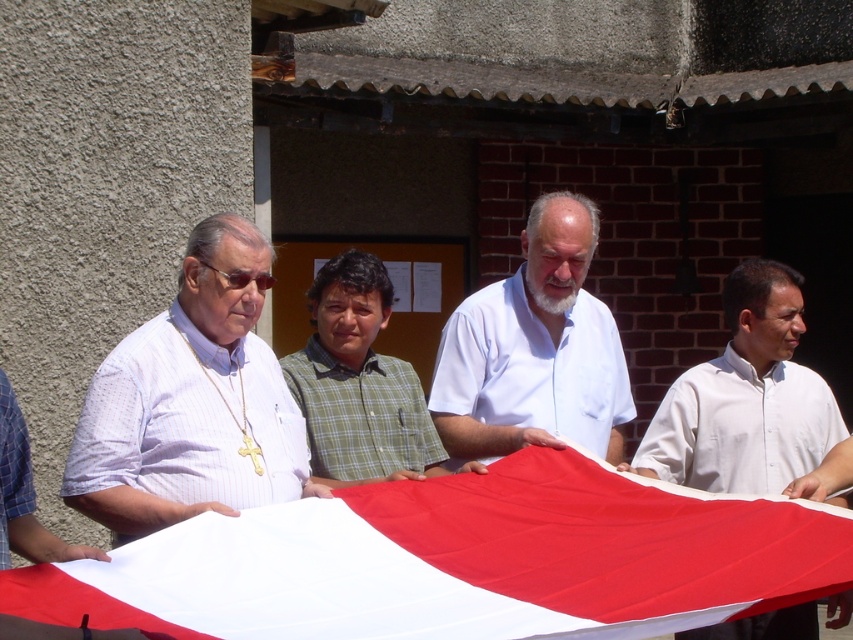
Question: Which object is closer to the camera taking this photo?

Choices:
 (A) white matte shirt at center
 (B) green checkered shirt at center
 (C) white striped shirt at left
 (D) white fabric flag at center

Answer: (D)

Question: Can you confirm if white fabric flag at center is positioned above green checkered shirt at center?

Choices:
 (A) yes
 (B) no

Answer: (B)

Question: Among these objects, which one is farthest from the camera?

Choices:
 (A) green checkered shirt at center
 (B) white smooth shirt at center
 (C) white fabric flag at center
 (D) white matte shirt at center

Answer: (D)

Question: Which object is positioned farthest from the white striped shirt at left?

Choices:
 (A) white smooth shirt at center
 (B) white matte shirt at center
 (C) green checkered shirt at center

Answer: (A)

Question: Is white striped shirt at left above green checkered shirt at center?

Choices:
 (A) no
 (B) yes

Answer: (B)

Question: Is white striped shirt at left thinner than green checkered shirt at center?

Choices:
 (A) no
 (B) yes

Answer: (A)